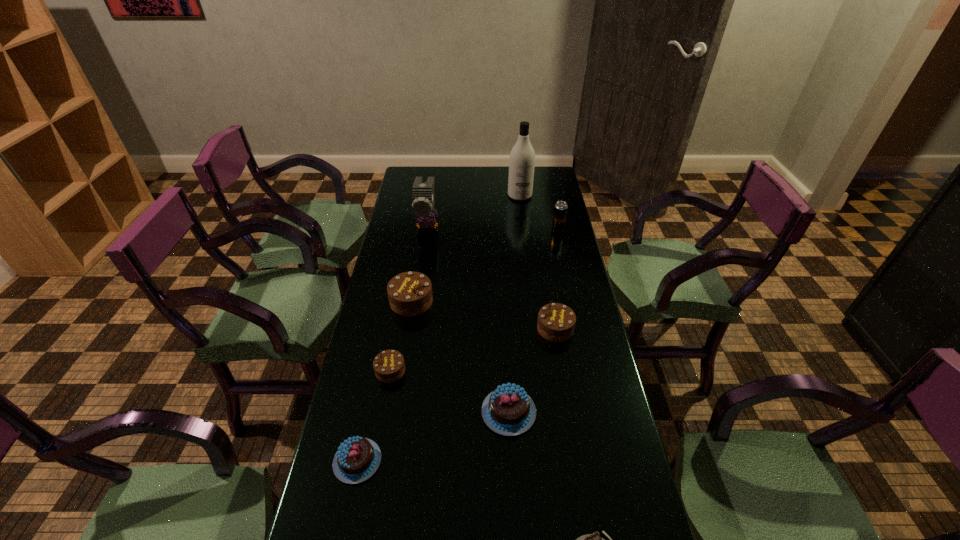
Identify which brown chocolate cake is the closest to the third nearest object. Please provide its 2D coordinates. Your answer should be formatted as a tuple, i.e. [(x, y)], where the tuple contains the x and y coordinates of a point satisfying the conditions above.

[(556, 322)]

You are a GUI agent. You are given a task and a screenshot of the screen. Output one action in this format:
    pyautogui.click(x=<x>, y=<y>)
    Task: Click on the closest pink chocolate cake to the white shampoo
    
    Given the screenshot: What is the action you would take?
    pyautogui.click(x=508, y=410)

Locate which pink chocolate cake is the closest to the bird. Please provide its 2D coordinates. Your answer should be formatted as a tuple, i.e. [(x, y)], where the tuple contains the x and y coordinates of a point satisfying the conditions above.

[(508, 410)]